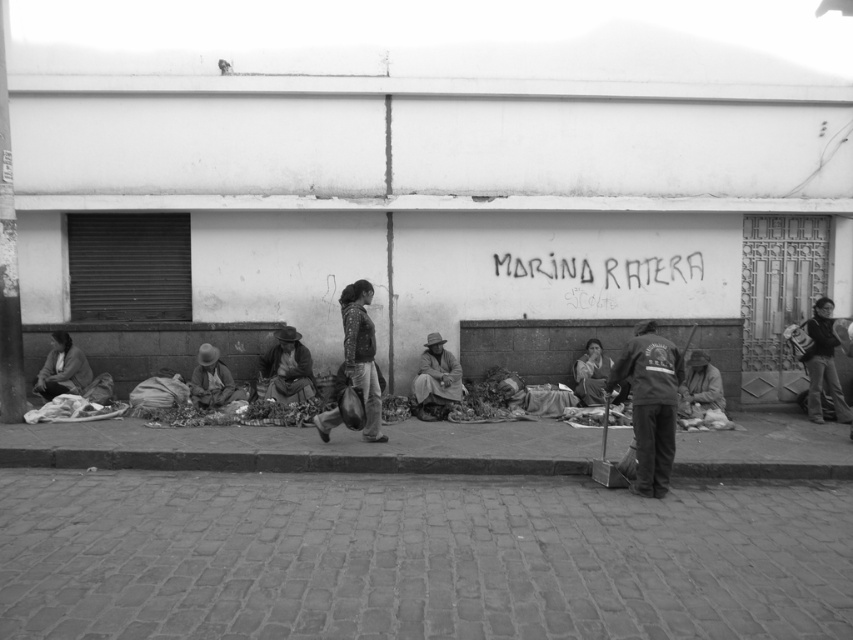
Question: Is the position of smooth concrete curb at lower center less distant than that of brown woven hat at center?

Choices:
 (A) yes
 (B) no

Answer: (A)

Question: Which point is farther to the camera?

Choices:
 (A) smooth concrete curb at lower center
 (B) dark fabric shawl at center

Answer: (B)

Question: Among these points, which one is nearest to the camera?

Choices:
 (A) (73, 372)
 (B) (454, 403)
 (C) (273, 381)
 (D) (375, 412)

Answer: (D)

Question: Is leather jacket at center to the left of matte brown jacket at lower left from the viewer's perspective?

Choices:
 (A) yes
 (B) no

Answer: (B)

Question: Among these objects, which one is farthest from the camera?

Choices:
 (A) smooth concrete curb at lower center
 (B) matte brown jacket at lower left
 (C) brown woven hat at center
 (D) dark gray jacket at right

Answer: (D)

Question: Does cobblestone pavement at lower center have a lesser width compared to dark gray fabric at lower right?

Choices:
 (A) no
 (B) yes

Answer: (A)